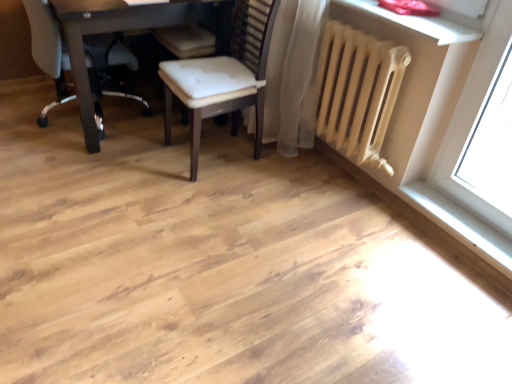
Locate an element on the screen. The width and height of the screenshot is (512, 384). vacant area to the right of wooden chair at center, which is the 2th chair in left-to-right order is located at coordinates (287, 182).